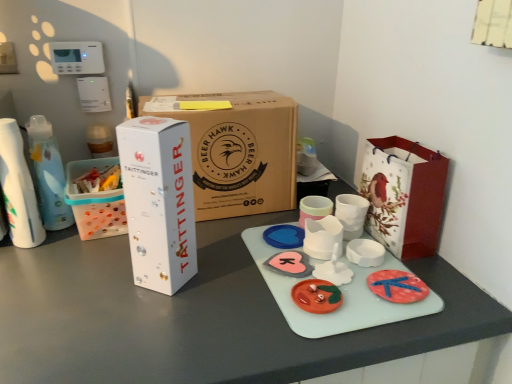
Image resolution: width=512 pixels, height=384 pixels. Identify the location of vacant area located to the right-hand side of white glossy box at left, marked as the 1th box in a front-to-back arrangement. (233, 283).